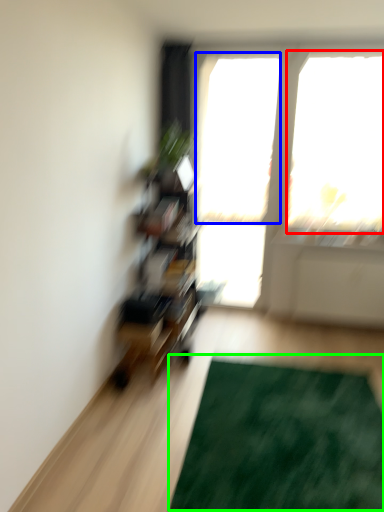
Question: Considering the real-world distances, which object is farthest from window screen (highlighted by a red box)? window screen (highlighted by a blue box) or doormat (highlighted by a green box)?

Choices:
 (A) window screen
 (B) doormat

Answer: (B)